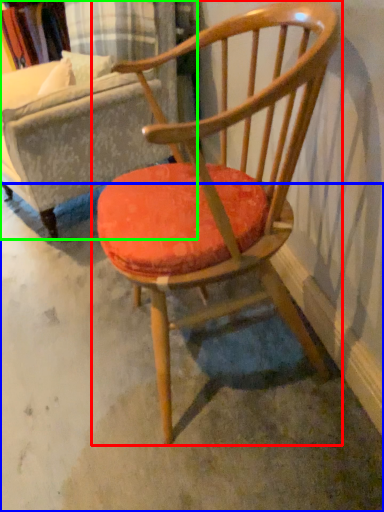
Question: Estimate the real-world distances between objects in this image. Which object is farther from chair (highlighted by a red box), concrete (highlighted by a blue box) or swivel chair (highlighted by a green box)?

Choices:
 (A) concrete
 (B) swivel chair

Answer: (B)